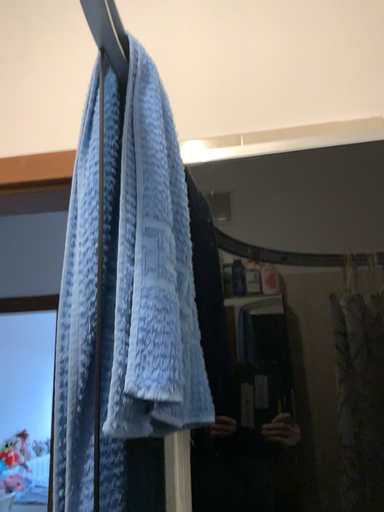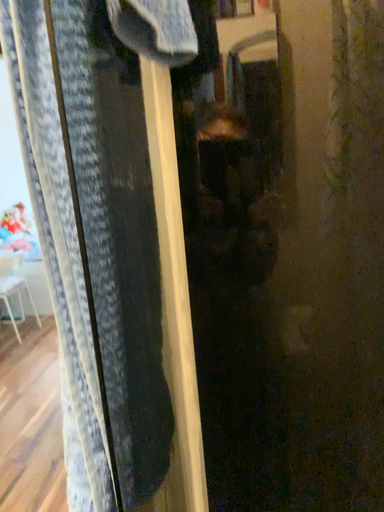
Question: Which way did the camera rotate in the video?

Choices:
 (A) rotated upward
 (B) rotated downward

Answer: (B)